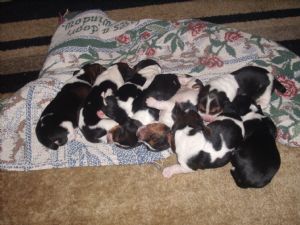
Find the location of a particular element. This screenshot has height=225, width=300. blue design on quilt is located at coordinates (145, 153), (129, 151), (78, 144).